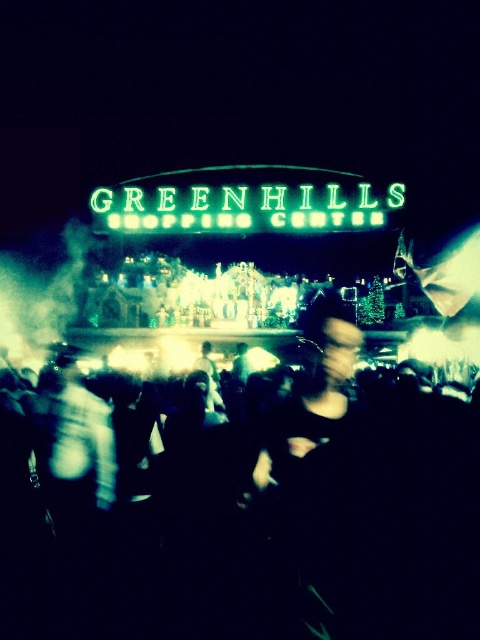
Which is behind, point (434, 573) or point (175, 224)?

The point (175, 224) is more distant.

Is black matte crowd at center to the left of neon green sign at center from the viewer's perspective?

Yes, black matte crowd at center is to the left of neon green sign at center.

At what (x,y) coordinates should I click in order to perform the action: click on black matte crowd at center. Please return your answer as a coordinate pair (x, y). Image resolution: width=480 pixels, height=640 pixels. Looking at the image, I should click on (264, 513).